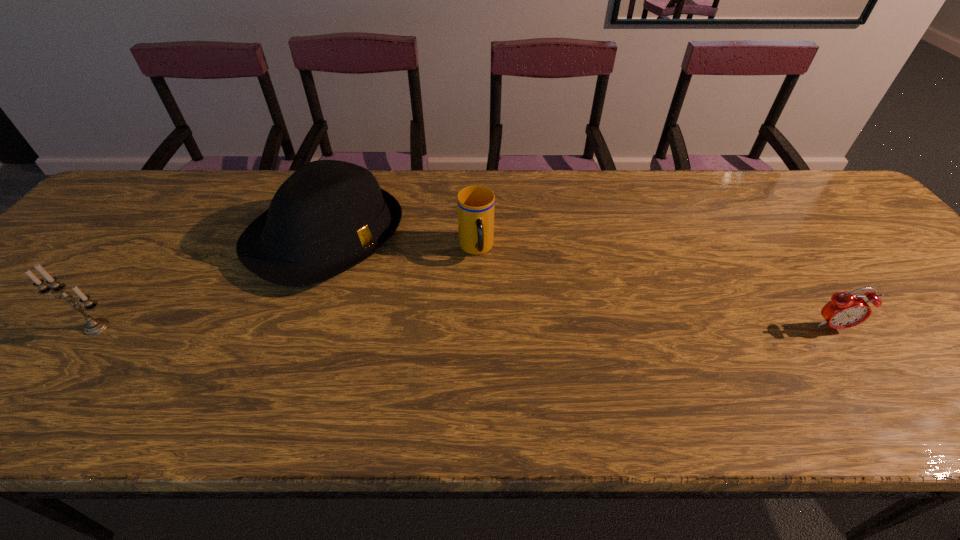
This screenshot has height=540, width=960. I want to click on vacant space at the far right corner of the desktop, so click(x=815, y=216).

Locate an element on the screen. This screenshot has height=540, width=960. vacant space that is in between the fedora and the third tallest object is located at coordinates (401, 243).

Locate an element on the screen. The height and width of the screenshot is (540, 960). vacant region between the fedora and the alarm clock is located at coordinates tap(579, 282).

Where is `free space between the second object from right to left and the third object from right to left`? free space between the second object from right to left and the third object from right to left is located at coordinates (401, 243).

Locate an element on the screen. Image resolution: width=960 pixels, height=540 pixels. unoccupied area between the third object from right to left and the leftmost object is located at coordinates (211, 282).

Identify the location of free area in between the fedora and the alarm clock. Image resolution: width=960 pixels, height=540 pixels. (579, 282).

Where is `vacant space in between the third object from right to left and the leftmost object`? vacant space in between the third object from right to left and the leftmost object is located at coordinates (211, 282).

Locate an element on the screen. The height and width of the screenshot is (540, 960). free space between the fedora and the leftmost object is located at coordinates (211, 282).

You are a GUI agent. You are given a task and a screenshot of the screen. Output one action in this format:
    pyautogui.click(x=<x>, y=<y>)
    Task: Click on the vacant region between the second object from left to right and the rightmost object
    This screenshot has height=540, width=960.
    Given the screenshot: What is the action you would take?
    pyautogui.click(x=579, y=282)

Where is `vacant area that lies between the third object from left to right and the candle`? Image resolution: width=960 pixels, height=540 pixels. vacant area that lies between the third object from left to right and the candle is located at coordinates (286, 288).